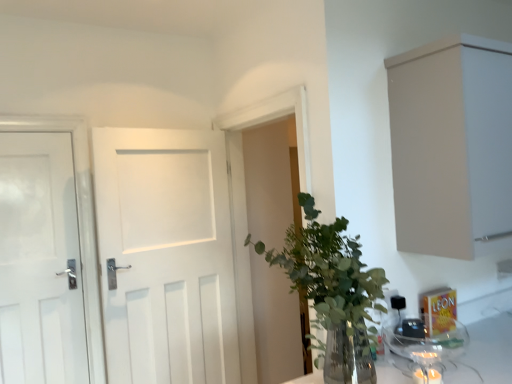
At what (x,y) coordinates should I click in order to perform the action: click on blank space situated above white matte door at left, positioned as the first door in left-to-right order (from a real-world perspective). Please return your answer as a coordinate pair (x, y). Looking at the image, I should click on (33, 128).